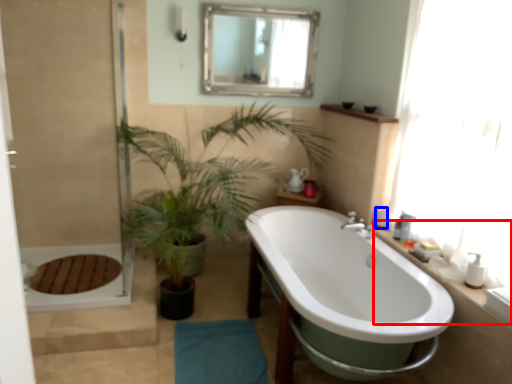
Question: Which object is further to the camera taking this photo, counter top (highlighted by a red box) or toiletry (highlighted by a blue box)?

Choices:
 (A) counter top
 (B) toiletry

Answer: (B)